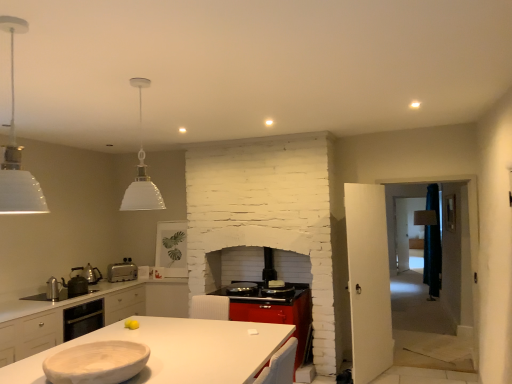
Question: Should I look upward or downward to see white matte countertop at center?

Choices:
 (A) up
 (B) down

Answer: (B)

Question: Does white matte pendant light at upper left, the second light fixture when ordered from back to front, lie in front of white matte countertop at center?

Choices:
 (A) yes
 (B) no

Answer: (A)

Question: Are white matte pendant light at upper left, the second light fixture when ordered from back to front, and white matte countertop at center located far from each other?

Choices:
 (A) yes
 (B) no

Answer: (A)

Question: Is white matte pendant light at upper left, the second light fixture when ordered from back to front, shorter than white matte countertop at center?

Choices:
 (A) no
 (B) yes

Answer: (A)

Question: From a real-world perspective, is white matte pendant light at upper left, the first light fixture positioned from the front, below white matte countertop at center?

Choices:
 (A) no
 (B) yes

Answer: (A)

Question: Can you confirm if white matte pendant light at upper left, the second light fixture when ordered from back to front, is taller than white matte countertop at center?

Choices:
 (A) yes
 (B) no

Answer: (A)

Question: Is white matte pendant light at upper left, the first light fixture positioned from the front, positioned behind white matte countertop at center?

Choices:
 (A) yes
 (B) no

Answer: (B)

Question: From the image's perspective, is silver metallic toaster at lower left over white matte countertop at center?

Choices:
 (A) no
 (B) yes

Answer: (B)

Question: Does silver metallic toaster at lower left appear on the right side of white matte countertop at center?

Choices:
 (A) yes
 (B) no

Answer: (B)

Question: Considering the relative positions of silver metallic toaster at lower left and white matte countertop at center in the image provided, is silver metallic toaster at lower left in front of white matte countertop at center?

Choices:
 (A) no
 (B) yes

Answer: (A)

Question: Does silver metallic toaster at lower left have a smaller size compared to white matte countertop at center?

Choices:
 (A) no
 (B) yes

Answer: (B)

Question: Considering the relative positions of silver metallic toaster at lower left and white matte countertop at center in the image provided, is silver metallic toaster at lower left behind white matte countertop at center?

Choices:
 (A) yes
 (B) no

Answer: (A)

Question: Is silver metallic toaster at lower left shorter than white matte countertop at center?

Choices:
 (A) no
 (B) yes

Answer: (B)

Question: Is metallic silver kettle at left, the 1th appliance in the front-to-back sequence, further to camera compared to white matte pendant light at upper left, the first light fixture positioned from the front?

Choices:
 (A) yes
 (B) no

Answer: (A)